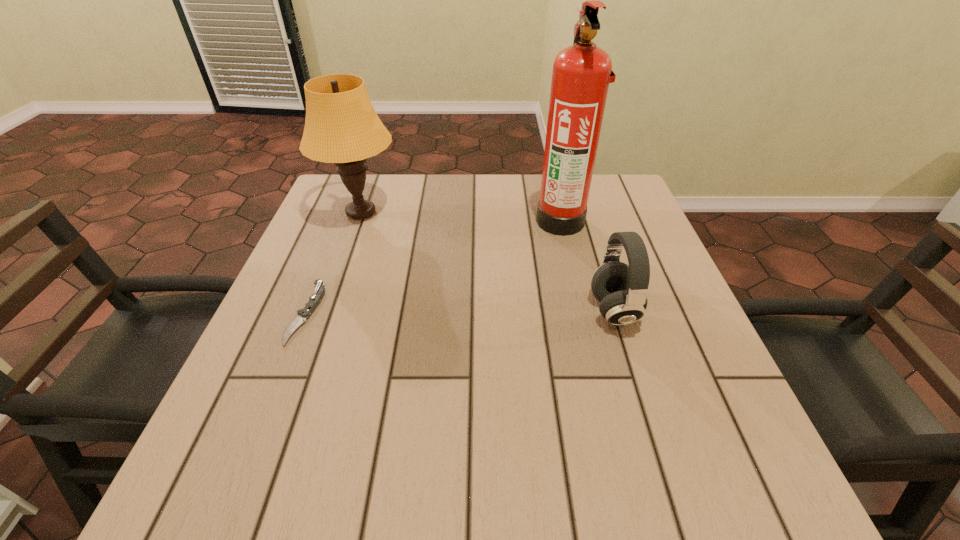
This screenshot has width=960, height=540. What are the coordinates of `unoccupied area between the third shortest object and the headset` in the screenshot? It's located at (488, 261).

Find the location of `vacant region between the fire extinguisher and the headset`. vacant region between the fire extinguisher and the headset is located at coordinates (588, 265).

I want to click on empty location between the lampshade and the headset, so click(488, 261).

You are a GUI agent. You are given a task and a screenshot of the screen. Output one action in this format:
    pyautogui.click(x=<x>, y=<y>)
    Task: Click on the free point between the shortest object and the third shortest object
    Image resolution: width=960 pixels, height=540 pixels.
    Given the screenshot: What is the action you would take?
    pyautogui.click(x=334, y=262)

Locate an element on the screen. The height and width of the screenshot is (540, 960). free space between the tallest object and the lampshade is located at coordinates (461, 217).

Identify the location of vacant area that lies between the fire extinguisher and the pocketknife. This screenshot has height=540, width=960. (434, 267).

Image resolution: width=960 pixels, height=540 pixels. I want to click on free space that is in between the shortest object and the headset, so click(x=460, y=312).

You are a GUI agent. You are given a task and a screenshot of the screen. Output one action in this format:
    pyautogui.click(x=<x>, y=<y>)
    Task: Click on the free spot between the fire extinguisher and the pocketknife
    
    Given the screenshot: What is the action you would take?
    pyautogui.click(x=434, y=267)

Identify the location of object identified as the second closest to the pocketknife. (582, 72).

Image resolution: width=960 pixels, height=540 pixels. What are the coordinates of `object that is the second closest to the shortest object` in the screenshot? It's located at (582, 72).